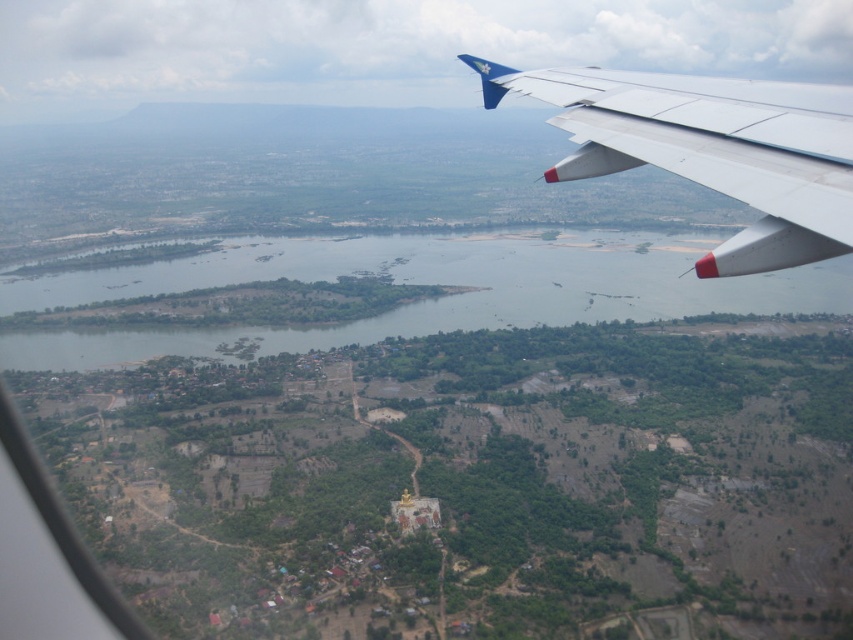
Question: Which of the following is the farthest from the observer?

Choices:
 (A) (381, 268)
 (B) (672, 145)

Answer: (A)

Question: Can you confirm if green grassy land at center is positioned to the left of white metallic wing at upper right?

Choices:
 (A) no
 (B) yes

Answer: (B)

Question: Does green grassy land at center appear on the right side of white metallic wing at upper right?

Choices:
 (A) yes
 (B) no

Answer: (B)

Question: Can you confirm if green grassy land at center is smaller than white metallic wing at upper right?

Choices:
 (A) no
 (B) yes

Answer: (A)

Question: Which point is farther to the camera?

Choices:
 (A) white metallic wing at upper right
 (B) green grassy land at center

Answer: (B)